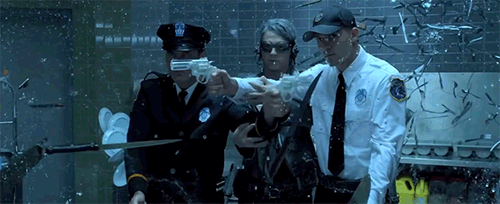
At what (x,y) coordinates should I click in order to perform the action: click on yellow jug. Please return your answer as a coordinate pair (x, y). This screenshot has height=204, width=500. Looking at the image, I should click on (408, 190).